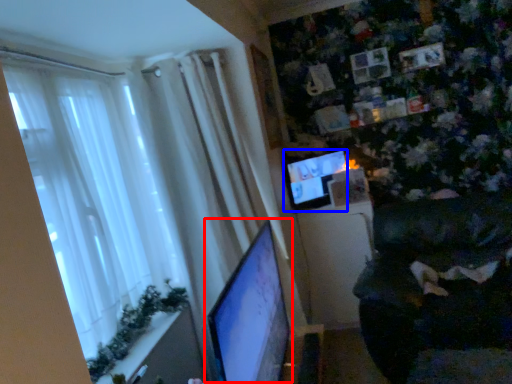
Question: Which point is further to the camera, computer monitor (highlighted by a red box) or computer monitor (highlighted by a blue box)?

Choices:
 (A) computer monitor
 (B) computer monitor

Answer: (B)